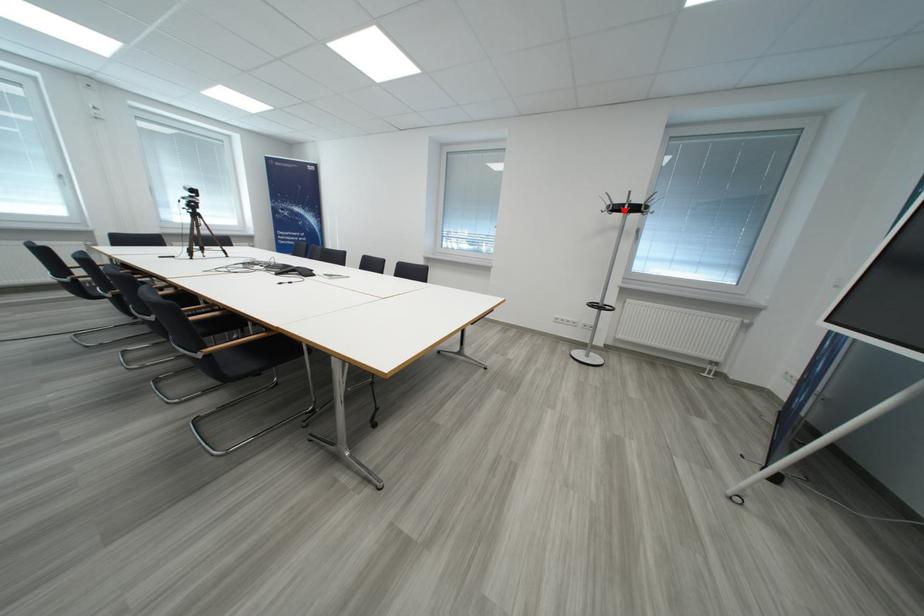
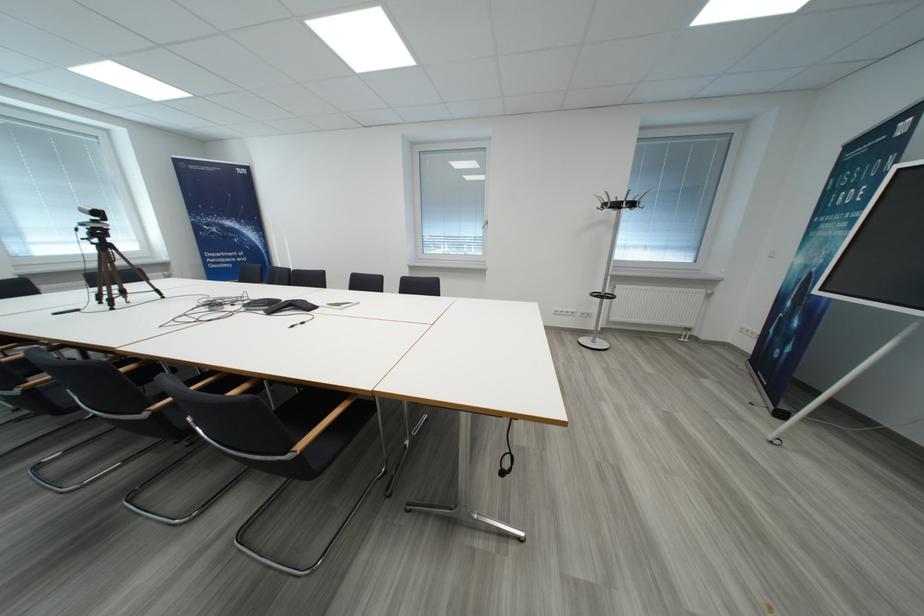
Find the pixel in the second image that matches the highlighted location in the first image.

(623, 208)